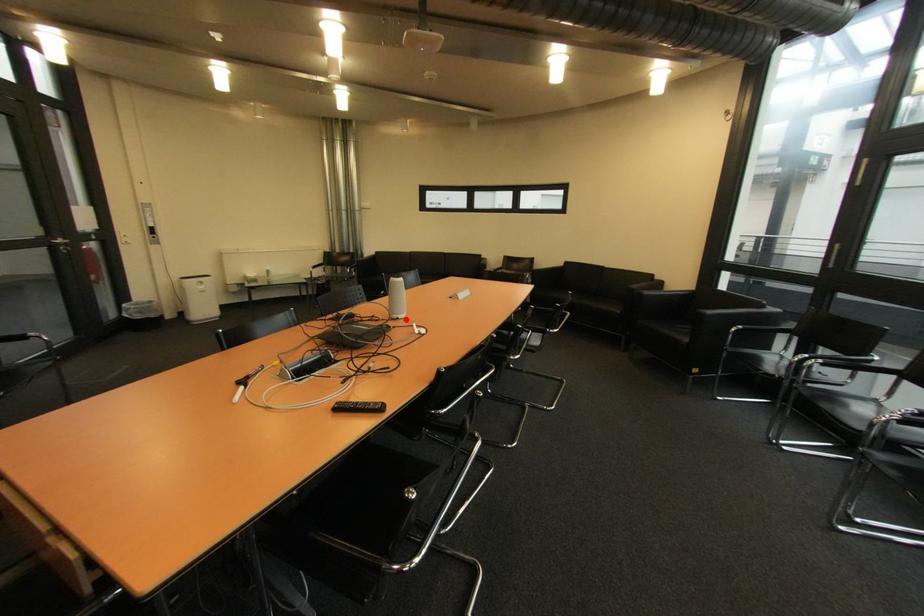
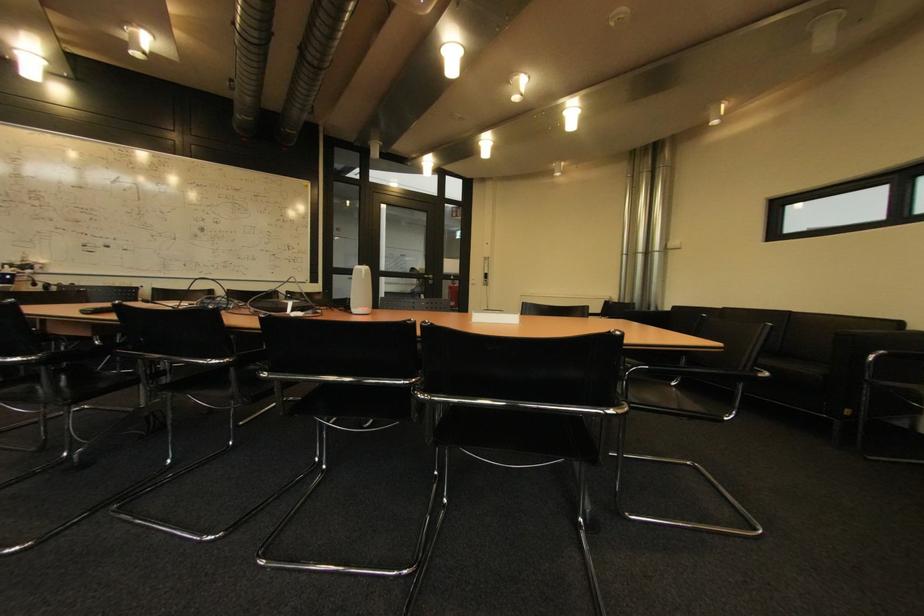
The point at the highlighted location is marked in the first image. Where is the corresponding point in the second image?

(359, 314)